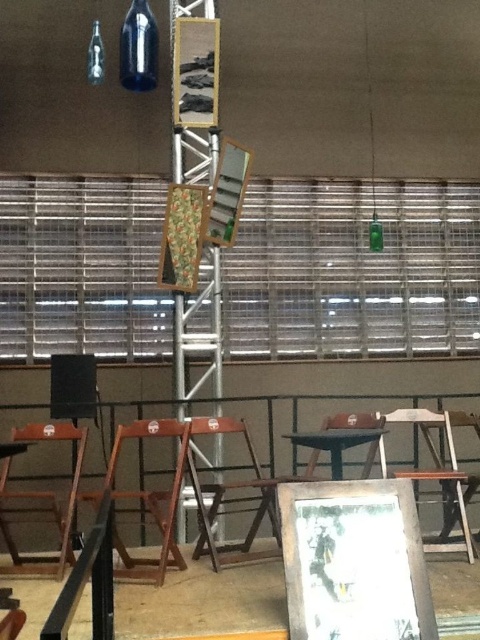
Question: Is wooden at lower left wider than wooden chair at lower right?

Choices:
 (A) yes
 (B) no

Answer: (A)

Question: Where is wooden chair at lower right located in relation to dark wood table at center in the image?

Choices:
 (A) below
 (B) above

Answer: (A)

Question: Which point is farther from the camera taking this photo?

Choices:
 (A) (86, 72)
 (B) (457, 410)

Answer: (B)

Question: Which point is farther to the camera?

Choices:
 (A) (156, 516)
 (B) (210, 518)

Answer: (B)

Question: Can you confirm if wooden at lower left is thinner than wooden at left?

Choices:
 (A) yes
 (B) no

Answer: (A)

Question: Which point appears closest to the camera in this image?

Choices:
 (A) (105, 483)
 (B) (146, 77)
 (C) (374, 440)
 (D) (79, 449)

Answer: (C)